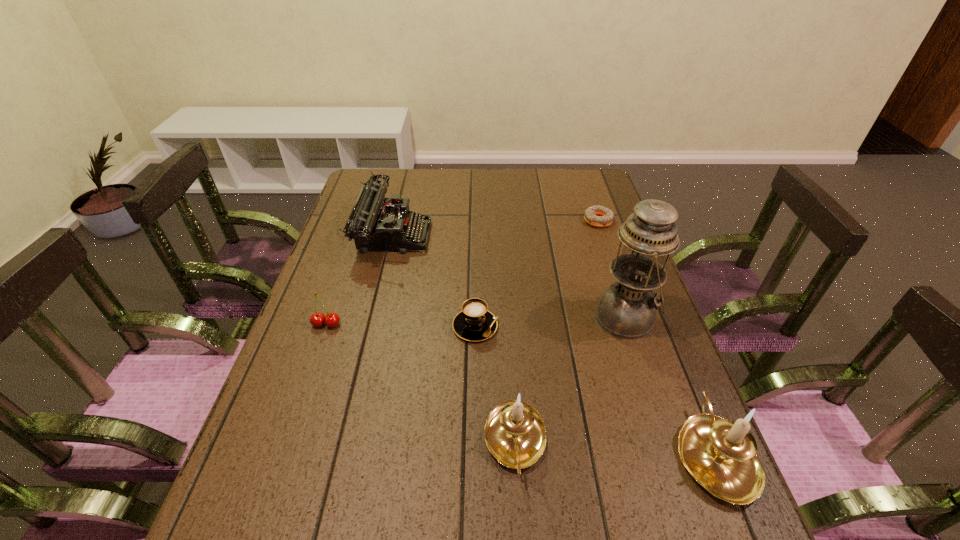
The width and height of the screenshot is (960, 540). What are the coordinates of `oil lamp located at the right edge` in the screenshot? It's located at (627, 309).

Where is `object situated at the near right corner`? object situated at the near right corner is located at coordinates (720, 454).

Locate an element on the screen. This screenshot has width=960, height=540. free space at the far edge of the desktop is located at coordinates (480, 183).

The width and height of the screenshot is (960, 540). Find the location of `free spot at the left edge of the desktop`. free spot at the left edge of the desktop is located at coordinates (330, 342).

In order to click on vacant area at the far left corner in this screenshot , I will do `click(392, 170)`.

Where is `free space at the near left corner of the desktop`? The image size is (960, 540). free space at the near left corner of the desktop is located at coordinates (275, 490).

You are a GUI agent. You are given a task and a screenshot of the screen. Output one action in this format:
    pyautogui.click(x=<x>, y=<y>)
    Task: Click on the free region at the far right corner
    
    Given the screenshot: What is the action you would take?
    pyautogui.click(x=586, y=186)

You are a GUI agent. You are given a task and a screenshot of the screen. Output one action in this format:
    pyautogui.click(x=<x>, y=<y>)
    Task: Click on the vacant region at the near right corner of the desktop
    
    Given the screenshot: What is the action you would take?
    pyautogui.click(x=654, y=495)

Locate an element on the screen. unoccupied position between the typewriter and the tallest object is located at coordinates click(510, 276).

Locate an element on the screen. Image resolution: width=960 pixels, height=540 pixels. unoccupied area between the sixth tallest object and the oil lamp is located at coordinates (551, 322).